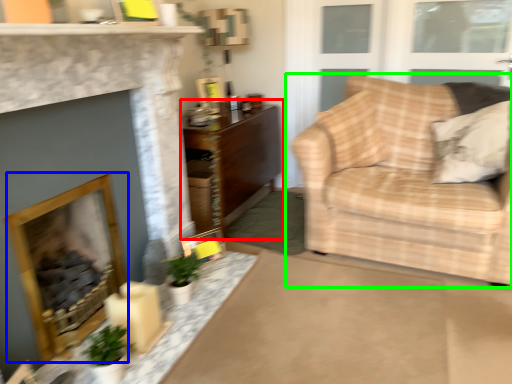
Question: Which object is positioned farthest from table (highlighted by a red box)? Select from fireplace (highlighted by a blue box) and studio couch (highlighted by a green box).

Choices:
 (A) fireplace
 (B) studio couch

Answer: (A)